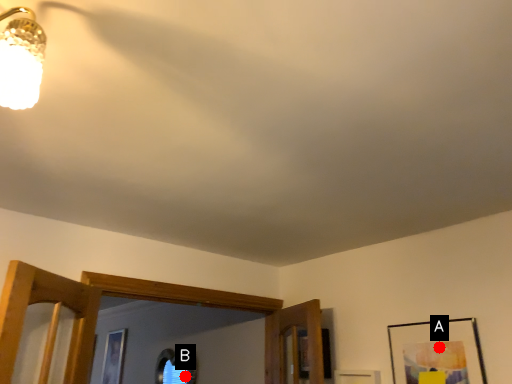
Question: Two points are circled on the image, labeled by A and B beside each circle. Which point is farther from the camera taking this photo?

Choices:
 (A) A is further
 (B) B is further

Answer: (B)